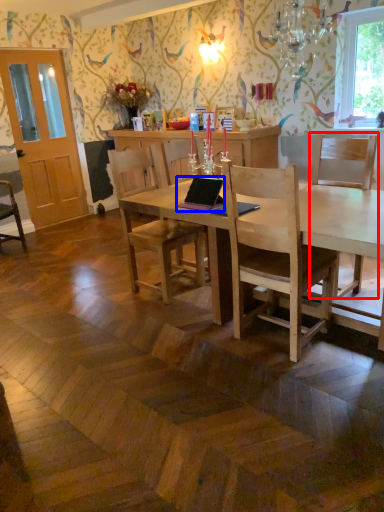
Question: Which point is further to the camera, chair (highlighted by a red box) or laptop (highlighted by a blue box)?

Choices:
 (A) chair
 (B) laptop

Answer: (B)